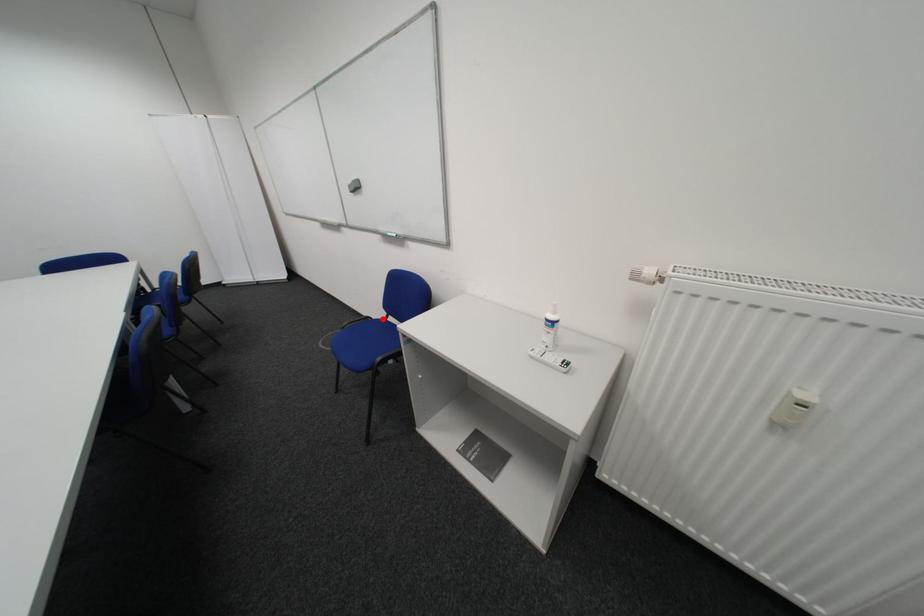
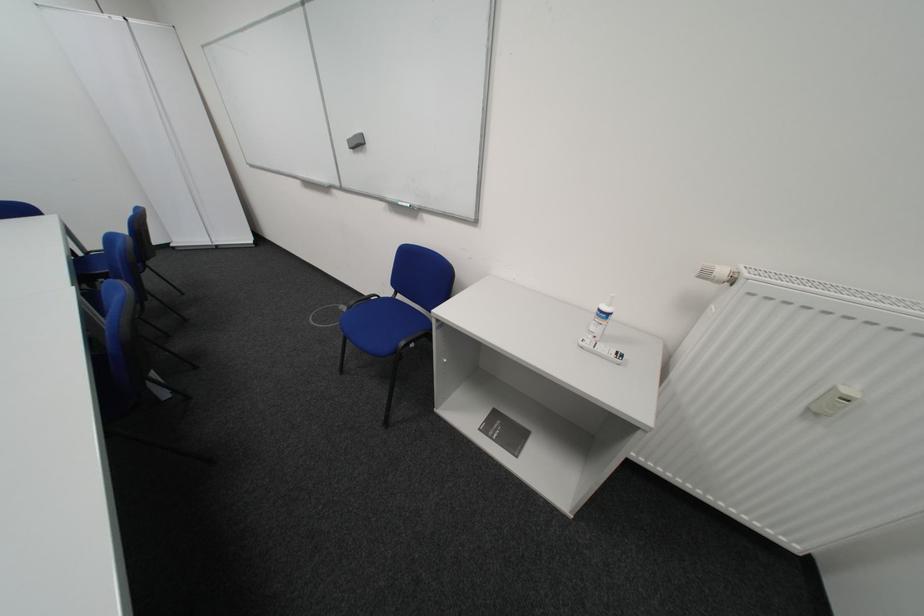
The point at the highlighted location is marked in the first image. Where is the corresponding point in the second image?

(390, 297)